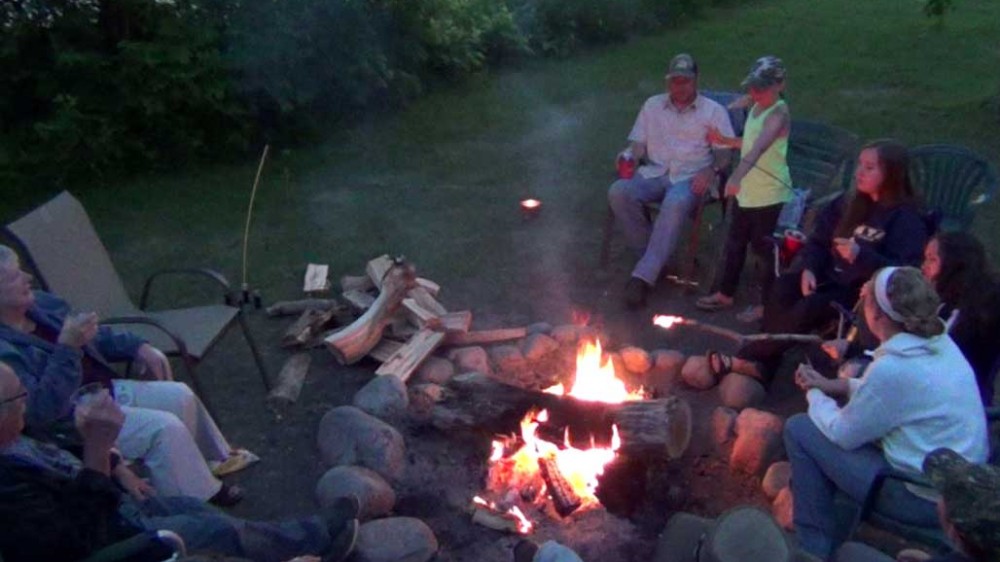
You are a GUI agent. You are given a task and a screenshot of the screen. Output one action in this format:
    pyautogui.click(x=<x>, y=<y>)
    Task: Click on the empty chair
    This screenshot has width=1000, height=562.
    Given the screenshot: What is the action you would take?
    pyautogui.click(x=195, y=321)